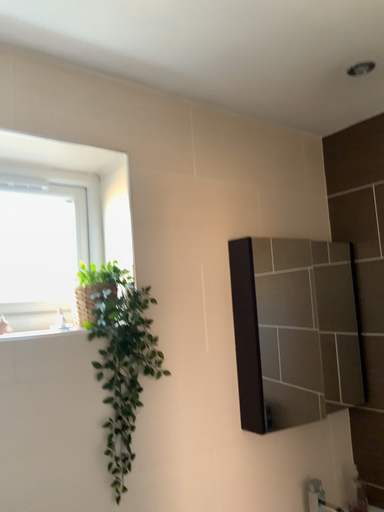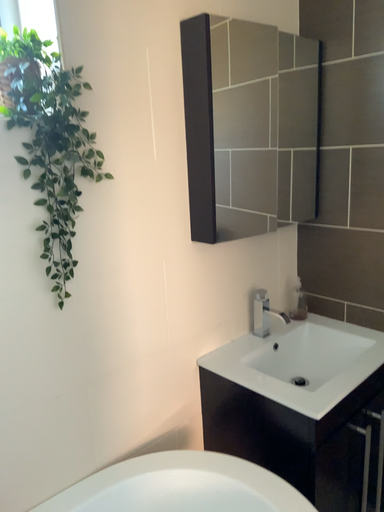
Question: How did the camera likely rotate when shooting the video?

Choices:
 (A) rotated left
 (B) rotated right

Answer: (B)